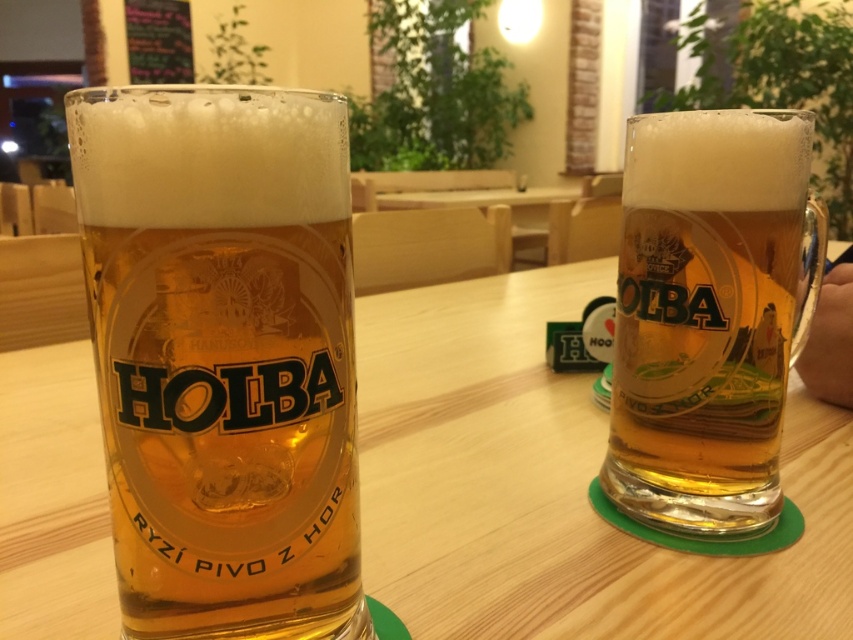
You are a bartender who needs to place a coaster between the two translucent glass mugs. The coaster has a diameter of 4 inches. Can you fit the coaster between the translucent glass mug at center and the translucent glass mug at right without touching either?

The distance between the translucent glass mug at center and the translucent glass mug at right is 9.87 inches. Since the coaster has a diameter of 4 inches, there is enough space to place it between them without touching either mug.

You are a bartender preparing drinks and need to place a coaster under the translucent glass mug at center. The coaster has a diameter of 10 cm. Is there enough space on the wooden table at center to place the coaster without it touching any other objects?

The wooden table at center is taller than the translucent glass mug at center, but this information does not provide details about the available space on the table. Without knowing the size of the table or the placement of other objects, it is impossible to determine if there is enough space for the coaster.

You are a bartender arranging items on the wooden table at center. You have a new decorative item that needs to be placed to the right of the translucent glass mug at right. Where should you place it?

Since the wooden table at center is positioned on the left side of the translucent glass mug at right, the decorative item should be placed to the right of the translucent glass mug at right, beyond its current position on the table.